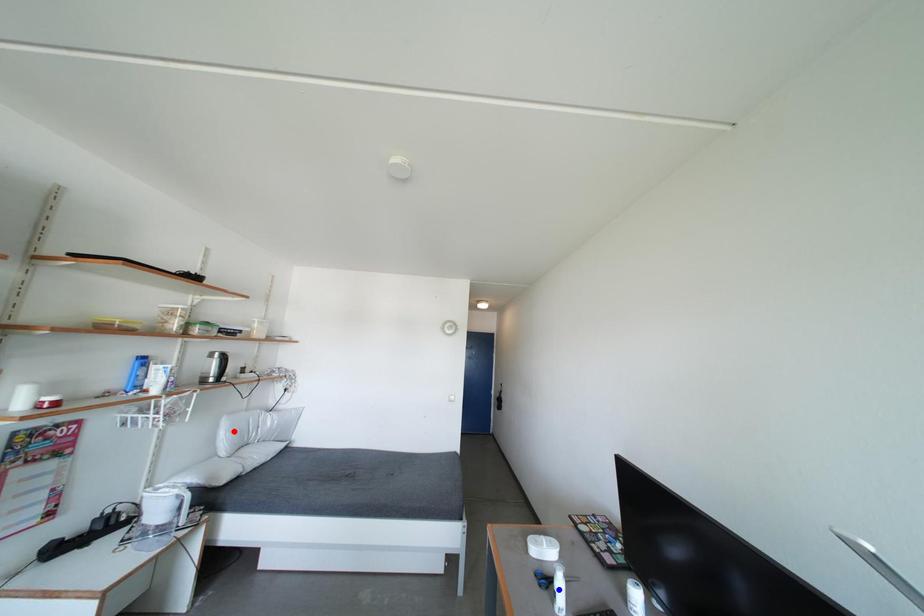
Question: In the image, two points are highlighted. Which point is nearer to the camera? Reply with the corresponding letter.

Choices:
 (A) blue point
 (B) red point

Answer: (A)